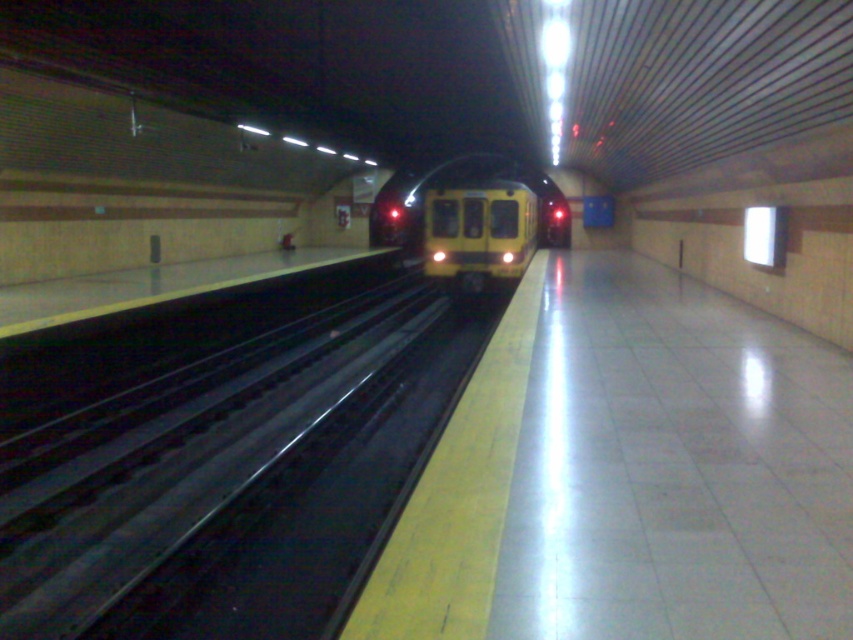
Is black metal track at center closer to camera compared to yellow matte train at center?

Yes, black metal track at center is in front of yellow matte train at center.

Between black metal track at center and yellow matte train at center, which one has less height?

black metal track at center is shorter.

This screenshot has height=640, width=853. Identify the location of black metal track at center. (234, 477).